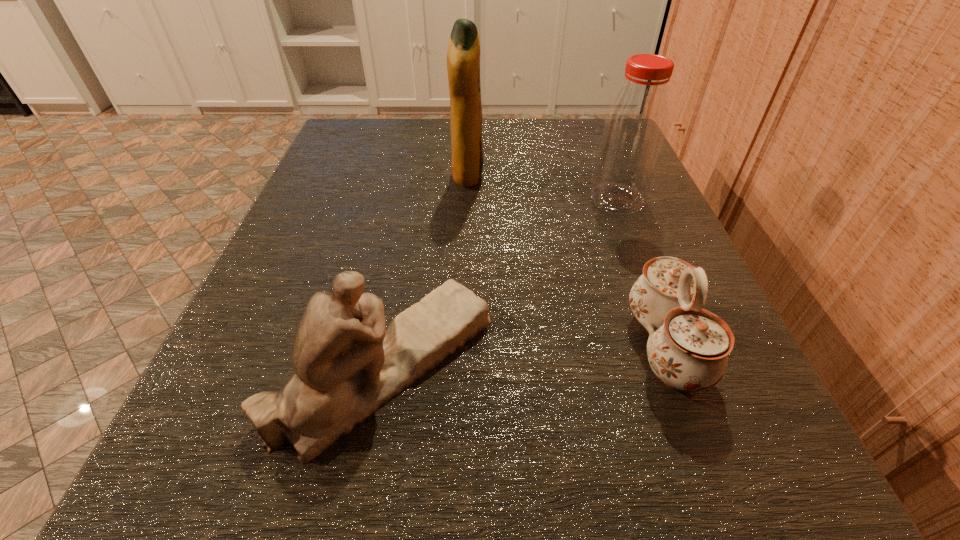
You are a GUI agent. You are given a task and a screenshot of the screen. Output one action in this format:
    pyautogui.click(x=<x>, y=<y>)
    Task: Click on the object present at the far edge
    
    Given the screenshot: What is the action you would take?
    pyautogui.click(x=463, y=57)

Find the location of `object that is at the near edge`. object that is at the near edge is located at coordinates (347, 365).

Where is `object located in the left edge section of the desktop`? This screenshot has height=540, width=960. object located in the left edge section of the desktop is located at coordinates (347, 365).

This screenshot has height=540, width=960. In order to click on bottle that is positioned at the right edge in this screenshot , I will do `click(635, 125)`.

Where is `chinaware that is at the right edge`? This screenshot has height=540, width=960. chinaware that is at the right edge is located at coordinates (688, 346).

I want to click on object present at the near left corner, so (347, 365).

The image size is (960, 540). What are the coordinates of `free space at the far edge of the desktop` in the screenshot? It's located at [x=497, y=172].

Find the location of a particular element. free spot at the near edge of the desktop is located at coordinates [x=506, y=526].

Where is `vacant space at the left edge of the desktop`? This screenshot has width=960, height=540. vacant space at the left edge of the desktop is located at coordinates (370, 227).

Where is `vacant position at the right edge of the desktop`? Image resolution: width=960 pixels, height=540 pixels. vacant position at the right edge of the desktop is located at coordinates (693, 260).